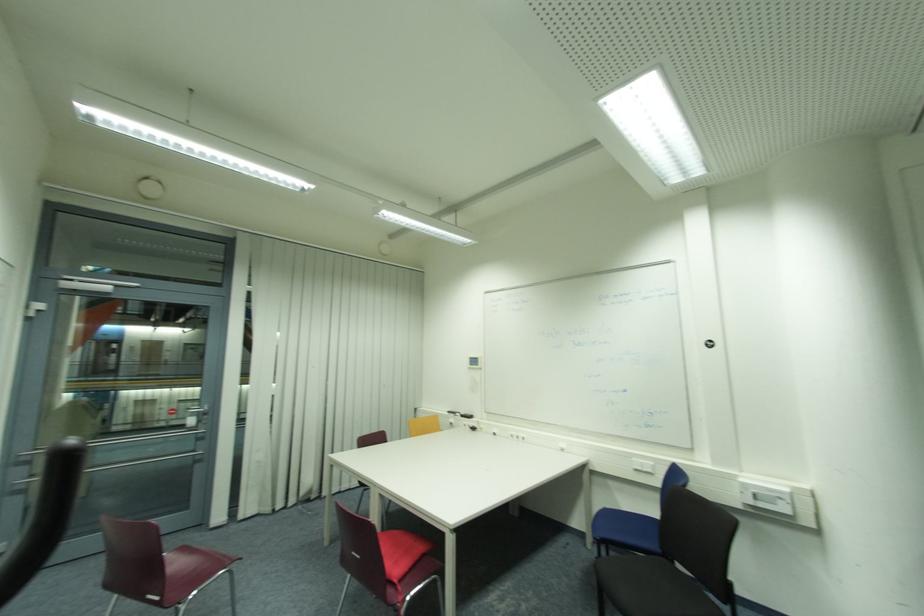
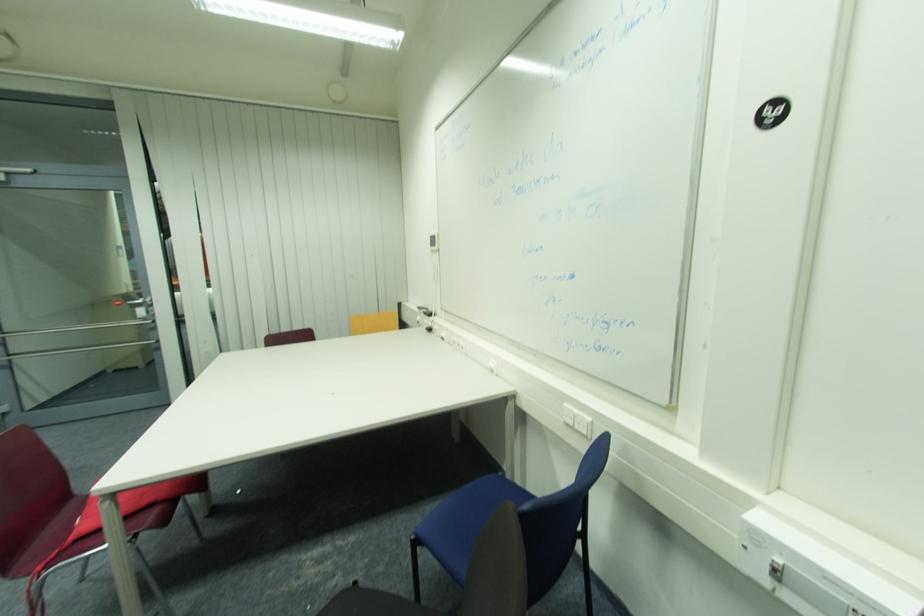
In a continuous first-person perspective shot, in which direction is the camera moving?

The cameraman moved toward right, forward.